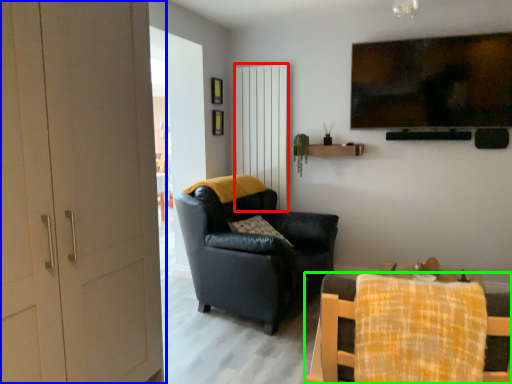
Question: Which object is positioned closest to curtain (highlighted by a red box)? Select from door (highlighted by a blue box) and chair (highlighted by a green box).

Choices:
 (A) door
 (B) chair

Answer: (A)